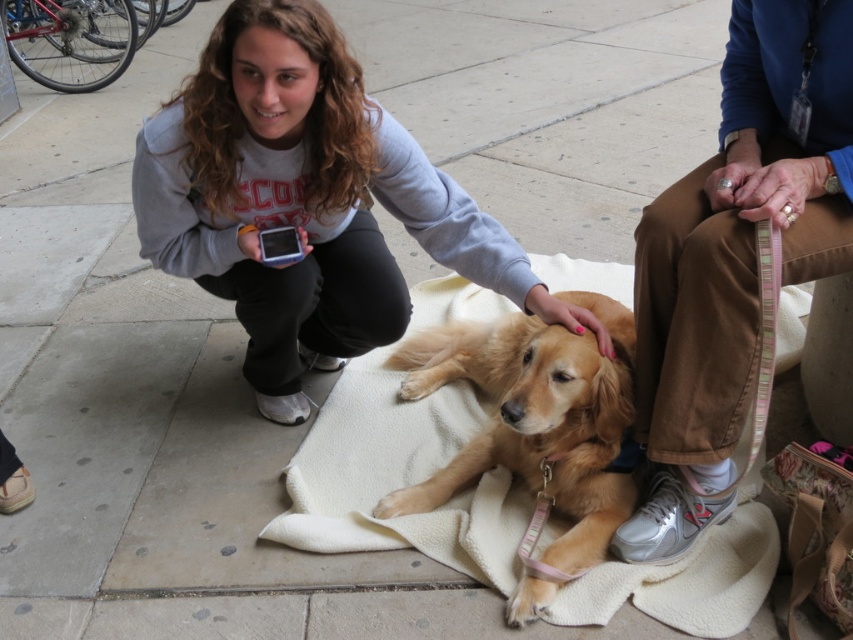
Question: From the image, what is the correct spatial relationship of matte gray sweatshirt at center in relation to golden fur dog at center?

Choices:
 (A) above
 (B) below

Answer: (A)

Question: Which point appears farthest from the camera in this image?

Choices:
 (A) (624, 321)
 (B) (257, 88)

Answer: (A)

Question: Which of the following is the closest to the observer?

Choices:
 (A) (592, 307)
 (B) (395, 387)

Answer: (A)

Question: Estimate the real-world distances between objects in this image. Which object is closer to the pink striped leash at lower right?

Choices:
 (A) golden fur dog at center
 (B) matte gray sweatshirt at center
 (C) white fleece blanket at center

Answer: (A)

Question: Does matte gray sweatshirt at center have a greater width compared to white fleece blanket at center?

Choices:
 (A) no
 (B) yes

Answer: (A)

Question: Observing the image, what is the correct spatial positioning of matte gray sweatshirt at center in reference to white fleece blanket at center?

Choices:
 (A) above
 (B) below

Answer: (A)